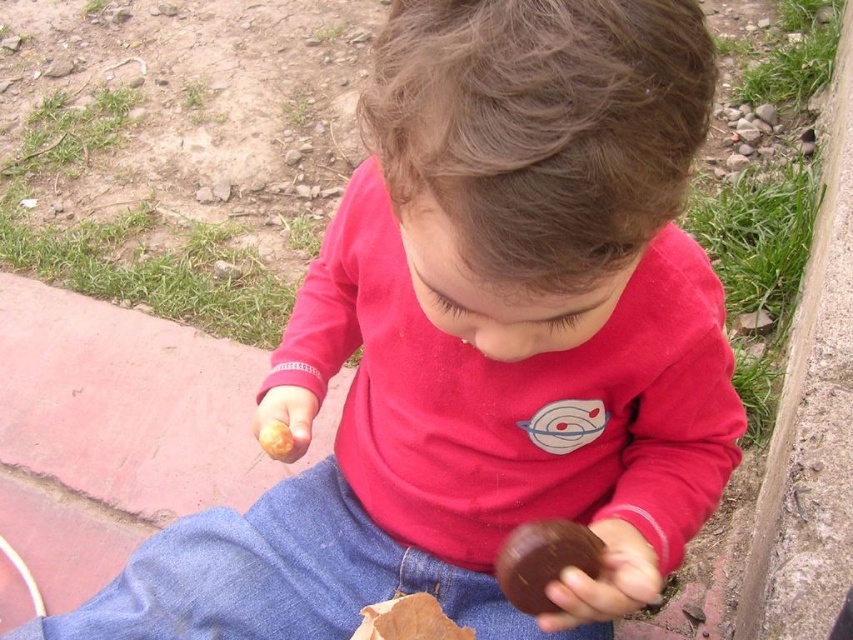
Between brown wooden ball at center and yellow matte food at center, which one has less height?

With less height is yellow matte food at center.

Which of these two, brown wooden ball at center or yellow matte food at center, stands taller?

Standing taller between the two is brown wooden ball at center.

Which is behind, point (543, 580) or point (279, 429)?

The point (279, 429) is more distant.

Identify the location of brown wooden ball at center. The width and height of the screenshot is (853, 640). (544, 561).